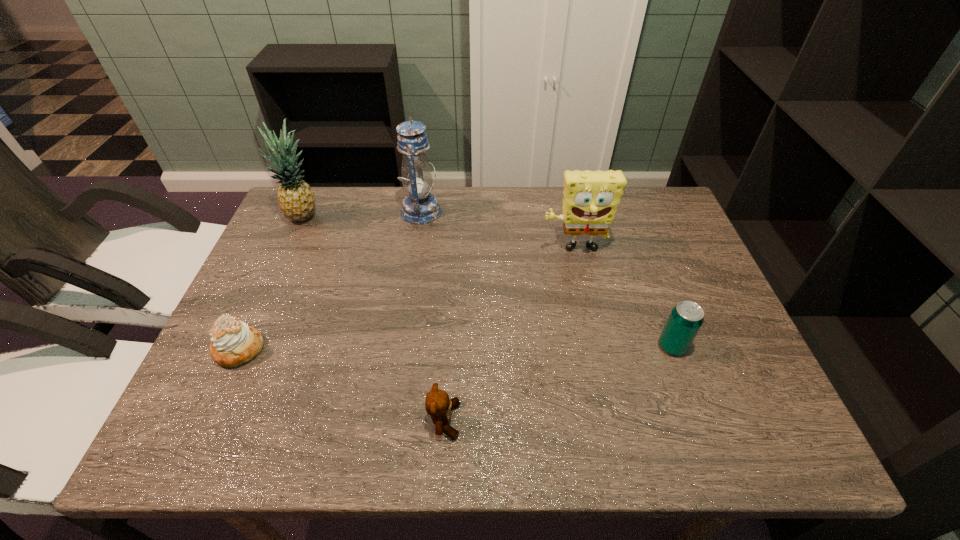
Where is `lantern`? This screenshot has height=540, width=960. lantern is located at coordinates (420, 206).

Where is `pineapple`? The height and width of the screenshot is (540, 960). pineapple is located at coordinates (296, 199).

Identify the location of sponge. (590, 201).

I want to click on the third tallest object, so click(x=590, y=201).

Where is `the rightmost object`? the rightmost object is located at coordinates (686, 318).

You are a GUI agent. You are given a task and a screenshot of the screen. Output one action in this format:
    pyautogui.click(x=<x>, y=<y>)
    Task: Click on the beer can
    
    Given the screenshot: What is the action you would take?
    pyautogui.click(x=686, y=318)

Image resolution: width=960 pixels, height=540 pixels. What are the coordinates of `the nearest object` in the screenshot? It's located at (437, 404).

Find the location of a particular element. the fourth object from left to right is located at coordinates (437, 404).

Locate an element on the screen. pastry is located at coordinates (233, 342).

In order to click on vacant space located 0.230m on the front-facing side of the lantern in this screenshot , I will do `click(516, 212)`.